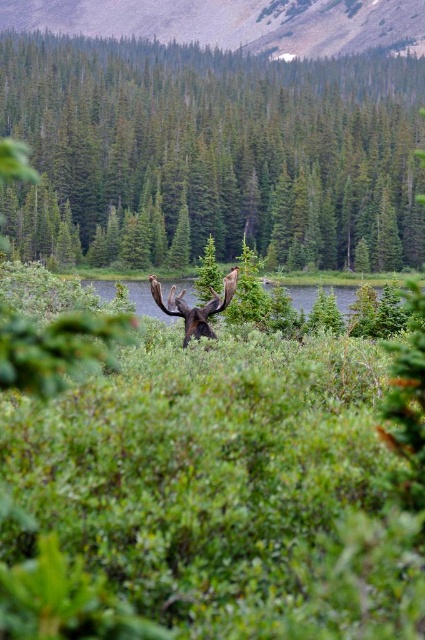
Question: Which object is positioned closest to the brown furry moose at center?

Choices:
 (A) green grassy lake at center
 (B) green leafy tree at center
 (C) rugged brown mountain at upper center

Answer: (A)

Question: Is green leafy tree at center above brown furry moose at center?

Choices:
 (A) yes
 (B) no

Answer: (A)

Question: Which point is farther to the camera?

Choices:
 (A) (85, 20)
 (B) (164, 308)
 (C) (129, 296)
 (D) (88, 189)

Answer: (A)

Question: Can you confirm if green leafy tree at center is bigger than rugged brown mountain at upper center?

Choices:
 (A) yes
 (B) no

Answer: (A)

Question: Can you confirm if rugged brown mountain at upper center is positioned above green grassy lake at center?

Choices:
 (A) no
 (B) yes

Answer: (B)

Question: Which object is farther from the camera taking this photo?

Choices:
 (A) green leafy tree at center
 (B) brown furry moose at center
 (C) green grassy lake at center

Answer: (A)